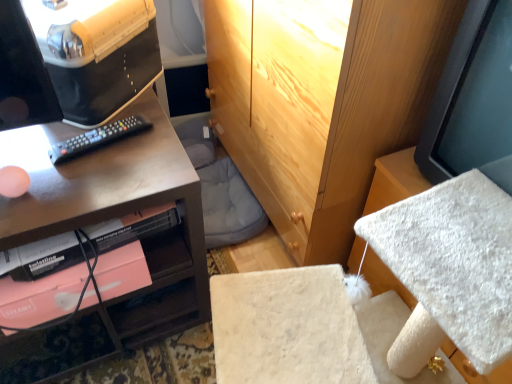
At what (x,y) coordinates should I click in order to perform the action: click on vacant space in front of matte black monitor at upper left. Please return your answer as a coordinate pair (x, y). This screenshot has width=512, height=384. Looking at the image, I should click on (84, 161).